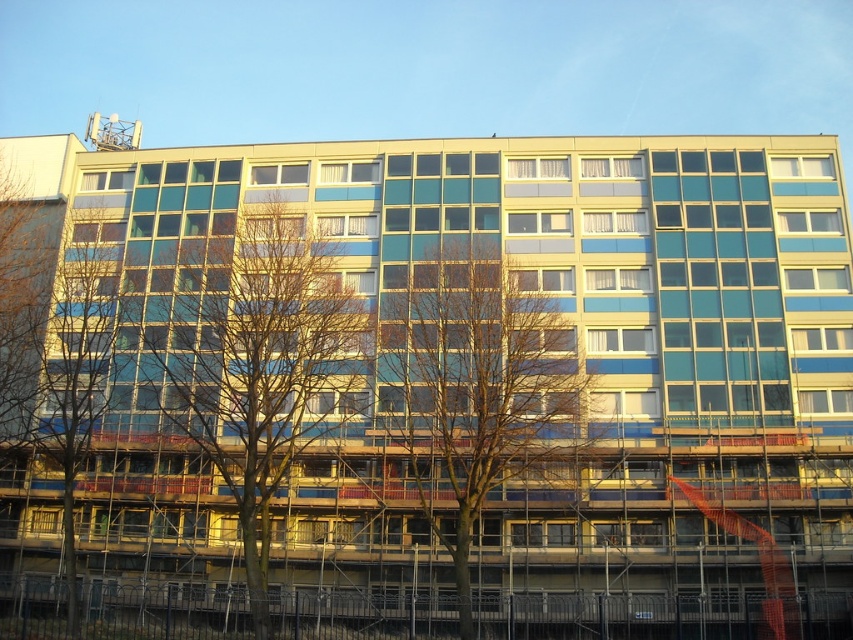
Is green leafy tree at center below bare wood tree at left?

Correct, green leafy tree at center is located below bare wood tree at left.

Who is higher up, green leafy tree at center or bare wood tree at left?

Positioned higher is bare wood tree at left.

Does point (212, 461) come in front of point (57, 385)?

Yes, point (212, 461) is closer to viewer.

Where is `green leafy tree at center`? This screenshot has height=640, width=853. green leafy tree at center is located at coordinates (248, 356).

Can you confirm if green leafy tree at center is positioned to the left of bare wood tree at center?

Yes, green leafy tree at center is to the left of bare wood tree at center.

Does green leafy tree at center have a larger size compared to bare wood tree at center?

Yes, green leafy tree at center is bigger than bare wood tree at center.

Is point (215, 474) positioned after point (415, 360)?

No, it is not.

Find the location of a particular element. This screenshot has height=640, width=853. green leafy tree at center is located at coordinates (248, 356).

Can you confirm if bare wood tree at center is positioned below bare wood tree at left?

Yes, bare wood tree at center is below bare wood tree at left.

Which of these two, bare wood tree at center or bare wood tree at left, stands shorter?

bare wood tree at center

What do you see at coordinates (474, 388) in the screenshot? I see `bare wood tree at center` at bounding box center [474, 388].

Locate an element on the screen. Image resolution: width=853 pixels, height=640 pixels. bare wood tree at center is located at coordinates (474, 388).